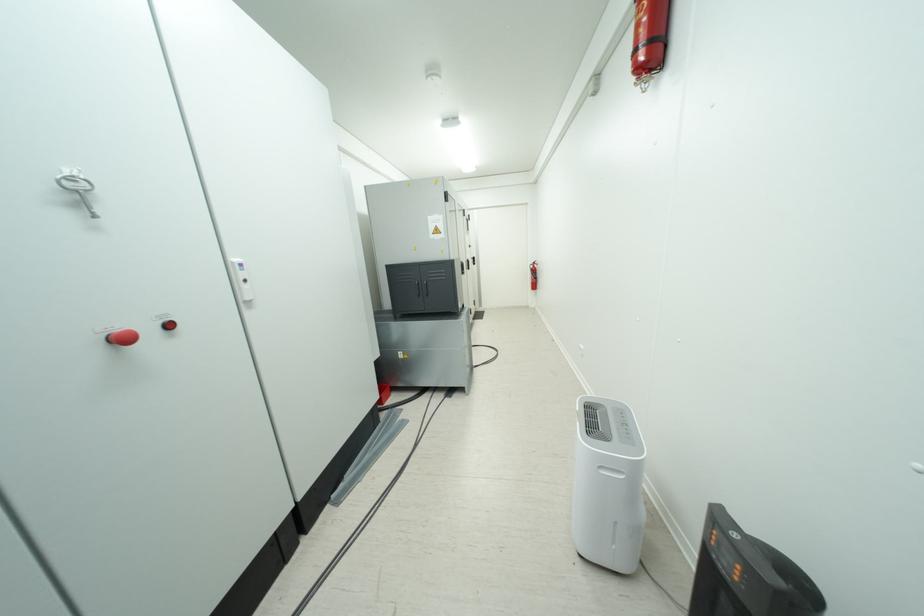
The image size is (924, 616). Describe the element at coordinates (122, 338) in the screenshot. I see `the small red button` at that location.